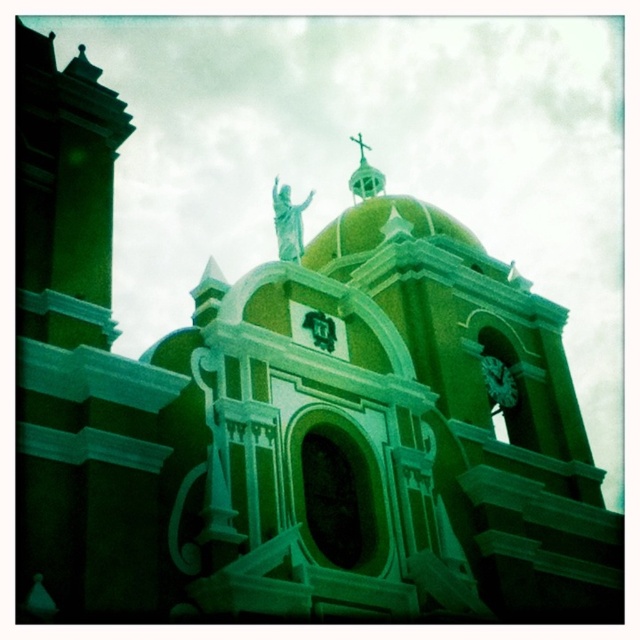
Question: Which point is farther to the camera?

Choices:
 (A) metallic gold cross at upper center
 (B) green marble statue at upper center

Answer: (A)

Question: Which of the following is the closest to the observer?

Choices:
 (A) (358, 140)
 (B) (298, 225)

Answer: (B)

Question: Does green marble statue at upper center appear over metallic gold cross at upper center?

Choices:
 (A) yes
 (B) no

Answer: (B)

Question: Does green marble statue at upper center have a greater width compared to metallic gold cross at upper center?

Choices:
 (A) no
 (B) yes

Answer: (B)

Question: Which of the following is the closest to the observer?

Choices:
 (A) metallic gold cross at upper center
 (B) green marble statue at upper center

Answer: (B)

Question: Does green marble statue at upper center appear on the right side of metallic gold cross at upper center?

Choices:
 (A) yes
 (B) no

Answer: (B)